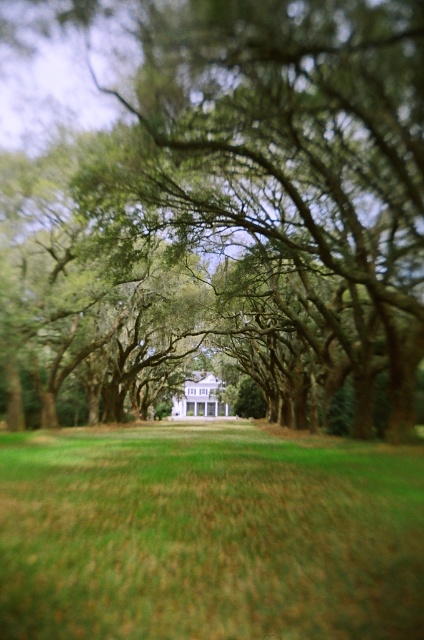
In the scene shown: You are standing at the starting point of the lawn and want to walk straight towards the white house at the far end. Is there a green leafy tree at center in your direct path? Please explain your reasoning based on the coordinates provided.

The green leafy tree at center is located at coordinates point (x=233, y=196). Since the path from the starting point to the white house is straight, and the tree is positioned along the central axis, it would likely block the direct path. Therefore, the green leafy tree at center is in the way.

You are a gardener planning to plant a new flower bed between the green leafy tree at center and the green grass at center. What is the minimum distance you need to leave between the flower bed and the tree to ensure it doesn

The minimum distance you need to leave between the flower bed and the green leafy tree at center should be at least 12.01 meters to ensure proper growth and avoid competition for resources.

You are planning to place a large picnic blanket on the green grass at center. Considering the size of the green leafy tree at center, will the tree provide enough shade for the blanket?

The green leafy tree at center is larger than the green grass at center, so it will provide sufficient shade for the picnic blanket.